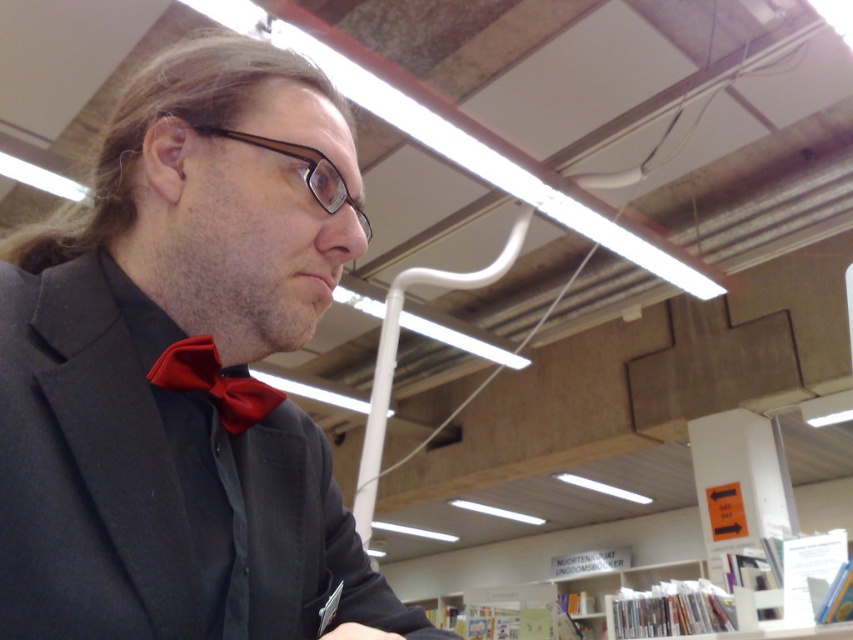
Is matte red bow tie at center bigger than brown plastic glasses at center?

No.

How far apart are matte red bow tie at center and brown plastic glasses at center?

A distance of 6.48 inches exists between matte red bow tie at center and brown plastic glasses at center.

Find the location of a particular element. The height and width of the screenshot is (640, 853). matte red bow tie at center is located at coordinates (213, 384).

The image size is (853, 640). Identify the location of matte red bow tie at center. (213, 384).

Does matte black suit at center appear on the right side of matte red bow tie at center?

Correct, you'll find matte black suit at center to the right of matte red bow tie at center.

Looking at this image, is matte black suit at center above matte red bow tie at center?

Yes, matte black suit at center is above matte red bow tie at center.

You are a GUI agent. You are given a task and a screenshot of the screen. Output one action in this format:
    pyautogui.click(x=<x>, y=<y>)
    Task: Click on the matte black suit at center
    
    Given the screenshot: What is the action you would take?
    pyautogui.click(x=184, y=371)

Find the location of a particular element. matte black suit at center is located at coordinates (184, 371).

Which is below, matte black suit at center or brown plastic glasses at center?

matte black suit at center is lower down.

What do you see at coordinates (184, 371) in the screenshot? I see `matte black suit at center` at bounding box center [184, 371].

Is point (73, 520) behind point (248, 140)?

No, (73, 520) is closer to viewer.

Find the location of a particular element. matte black suit at center is located at coordinates pyautogui.click(x=184, y=371).